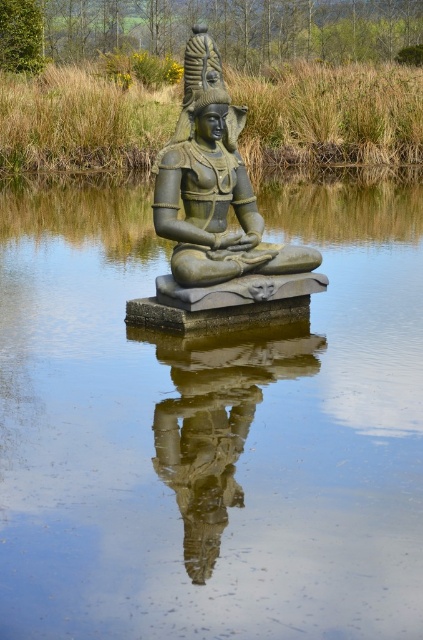
Question: Which point appears farthest from the camera in this image?

Choices:
 (A) (184, 490)
 (B) (167, 200)

Answer: (B)

Question: Is transparent glass water at center below reflective stone statue at center?

Choices:
 (A) no
 (B) yes

Answer: (A)

Question: Which of the following is the closest to the observer?

Choices:
 (A) reflective stone statue at center
 (B) green stone statue at center

Answer: (A)

Question: Which of the following is the farthest from the observer?

Choices:
 (A) (320, 385)
 (B) (214, 259)

Answer: (B)

Question: Does transparent glass water at center lie in front of green stone statue at center?

Choices:
 (A) no
 (B) yes

Answer: (B)

Question: Is green stone statue at center bigger than reflective stone statue at center?

Choices:
 (A) yes
 (B) no

Answer: (A)